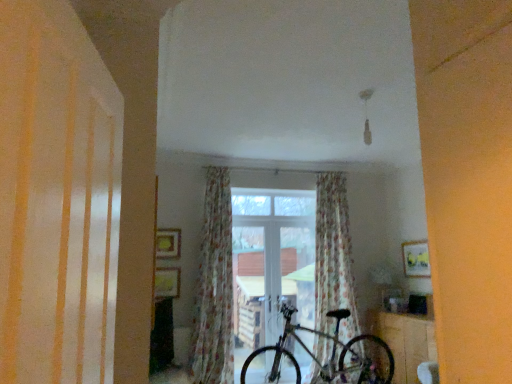
In order to face wooden table at lower right, should I rotate leftwards or rightwards?

To align with it, rotate right about 20.586°.

Measure the distance between point (86, 111) and camera.

Point (86, 111) and camera are 1.02 meters apart from each other.

Where is `shiny metallic bicycle at center`? Image resolution: width=512 pixels, height=384 pixels. shiny metallic bicycle at center is located at coordinates (330, 357).

From a real-world perspective, starting from the wooden table at lower right, which curtain is the 2nd one vertically above it? Please provide its 2D coordinates.

[(334, 256)]

Based on their positions, is floral fabric curtain at center, the 1th curtain positioned from the right, located to the left or right of wooden table at lower right?

Based on their positions, floral fabric curtain at center, the 1th curtain positioned from the right, is located to the left of wooden table at lower right.

Which object is thinner, floral fabric curtain at center, acting as the second curtain starting from the left, or wooden table at lower right?

With smaller width is floral fabric curtain at center, acting as the second curtain starting from the left.

From a real-world perspective, between transparent glass window at center and floral fabric curtain at center, which is the 2th curtain from right to left, who is vertically lower?

transparent glass window at center.

From the image's perspective, which is below, transparent glass window at center or floral fabric curtain at center, which is the 2th curtain from right to left?

transparent glass window at center is shown below in the image.

Does point (245, 289) come behind point (214, 174)?

That is True.

Between transparent glass window at center and floral fabric curtain at center, which is the 2th curtain from right to left, which one has more height?

floral fabric curtain at center, which is the 2th curtain from right to left.

The image size is (512, 384). Identify the location of table located in front of the transparent glass window at center. (405, 341).

From a real-world perspective, which object stands above the other?

transparent glass window at center, from a real-world perspective.

Is wooden table at lower right looking in the opposite direction of transparent glass window at center?

wooden table at lower right is not turned away from transparent glass window at center.

Can you confirm if wooden table at lower right is wider than transparent glass window at center?

Indeed, wooden table at lower right has a greater width compared to transparent glass window at center.

In the scene shown: Which is in front, white glossy shutter at left or transparent glass window at center?

white glossy shutter at left.

Can you confirm if white glossy shutter at left is positioned to the right of transparent glass window at center?

No.

Do you think white glossy shutter at left is within transparent glass window at center, or outside of it?

white glossy shutter at left is not enclosed by transparent glass window at center.

Could you tell me if white glossy shutter at left is turned towards transparent glass window at center?

No.

From a real-world perspective, which object stands above the other?

white glossy shutter at left, from a real-world perspective.

Relative to shiny metallic bicycle at center, is white glossy shutter at left in front or behind?

Clearly, white glossy shutter at left is in front of shiny metallic bicycle at center.

In the image, is white glossy shutter at left on the left side or the right side of shiny metallic bicycle at center?

white glossy shutter at left is to the left of shiny metallic bicycle at center.

Is white glossy shutter at left facing away from shiny metallic bicycle at center?

No, shiny metallic bicycle at center is not at the back of white glossy shutter at left.

In terms of height, does white glossy shutter at left look taller or shorter compared to floral fabric curtain at center, marked as the first curtain in a left-to-right arrangement?

Clearly, white glossy shutter at left is shorter compared to floral fabric curtain at center, marked as the first curtain in a left-to-right arrangement.

From a real-world perspective, which object stands above the other?

From a 3D spatial view, white glossy shutter at left is above.

From the image's perspective, between white glossy shutter at left and floral fabric curtain at center, marked as the first curtain in a left-to-right arrangement, who is located below?

From the image's view, floral fabric curtain at center, marked as the first curtain in a left-to-right arrangement, is below.

In the image, is white glossy shutter at left positioned in front of or behind floral fabric curtain at center, which is the 2th curtain from right to left?

In the image, white glossy shutter at left appears in front of floral fabric curtain at center, which is the 2th curtain from right to left.

Can you confirm if wooden table at lower right is smaller than white glossy shutter at left?

No, wooden table at lower right is not smaller than white glossy shutter at left.

Is white glossy shutter at left completely or partially inside wooden table at lower right?

No, white glossy shutter at left is not a part of wooden table at lower right.

Is point (415, 329) more distant than point (98, 178)?

Yes, point (415, 329) is farther from viewer.

The width and height of the screenshot is (512, 384). I want to click on table that appears below the white glossy shutter at left (from the image's perspective), so click(405, 341).

Where is `table below the floral fabric curtain at center, the 1th curtain positioned from the right (from the image's perspective)`? This screenshot has height=384, width=512. table below the floral fabric curtain at center, the 1th curtain positioned from the right (from the image's perspective) is located at coordinates (405, 341).

The height and width of the screenshot is (384, 512). What are the coordinates of `window behind the floral fabric curtain at center, marked as the first curtain in a left-to-right arrangement` in the screenshot? It's located at (272, 259).

Looking at the image, which one is located closer to transparent glass window at center, floral fabric curtain at center, which is the 2th curtain from right to left, or white glossy shutter at left?

floral fabric curtain at center, which is the 2th curtain from right to left, lies closer to transparent glass window at center than the other object.

When comparing their distances from wooden table at lower right, does transparent glass window at center or white glossy shutter at left seem further?

The object further to wooden table at lower right is white glossy shutter at left.

When comparing their distances from shiny metallic bicycle at center, does white glossy shutter at left or transparent glass window at center seem further?

Based on the image, white glossy shutter at left appears to be further to shiny metallic bicycle at center.

Estimate the real-world distances between objects in this image. Which object is further from wooden table at lower right, floral fabric curtain at center, which is the 2th curtain from right to left, or floral fabric curtain at center, acting as the second curtain starting from the left?

Among the two, floral fabric curtain at center, which is the 2th curtain from right to left, is located further to wooden table at lower right.

From the picture: Which object lies nearer to the anchor point white glossy shutter at left, wooden table at lower right or shiny metallic bicycle at center?

shiny metallic bicycle at center is positioned closer to the anchor white glossy shutter at left.

When comparing their distances from floral fabric curtain at center, which is the 2th curtain from right to left, does white glossy shutter at left or shiny metallic bicycle at center seem closer?

The object closer to floral fabric curtain at center, which is the 2th curtain from right to left, is shiny metallic bicycle at center.

In the scene shown: From the image, which object appears to be nearer to floral fabric curtain at center, the 1th curtain positioned from the right, white glossy shutter at left or floral fabric curtain at center, which is the 2th curtain from right to left?

floral fabric curtain at center, which is the 2th curtain from right to left, lies closer to floral fabric curtain at center, the 1th curtain positioned from the right, than the other object.

Considering their positions, is floral fabric curtain at center, acting as the second curtain starting from the left, positioned further to floral fabric curtain at center, which is the 2th curtain from right to left, than wooden table at lower right?

The object further to floral fabric curtain at center, which is the 2th curtain from right to left, is wooden table at lower right.

This screenshot has height=384, width=512. In order to click on table between white glossy shutter at left and floral fabric curtain at center, the 1th curtain positioned from the right, in the front-back direction in this screenshot , I will do `click(405, 341)`.

At what (x,y) coordinates should I click in order to perform the action: click on window between floral fabric curtain at center, which is the 2th curtain from right to left, and floral fabric curtain at center, acting as the second curtain starting from the left, in the horizontal direction. Please return your answer as a coordinate pair (x, y). The width and height of the screenshot is (512, 384). Looking at the image, I should click on (272, 259).

I want to click on bicycle between white glossy shutter at left and floral fabric curtain at center, marked as the first curtain in a left-to-right arrangement, in the front-back direction, so click(x=330, y=357).

This screenshot has height=384, width=512. In order to click on bicycle between floral fabric curtain at center, which is the 2th curtain from right to left, and wooden table at lower right from left to right in this screenshot , I will do `click(330, 357)`.